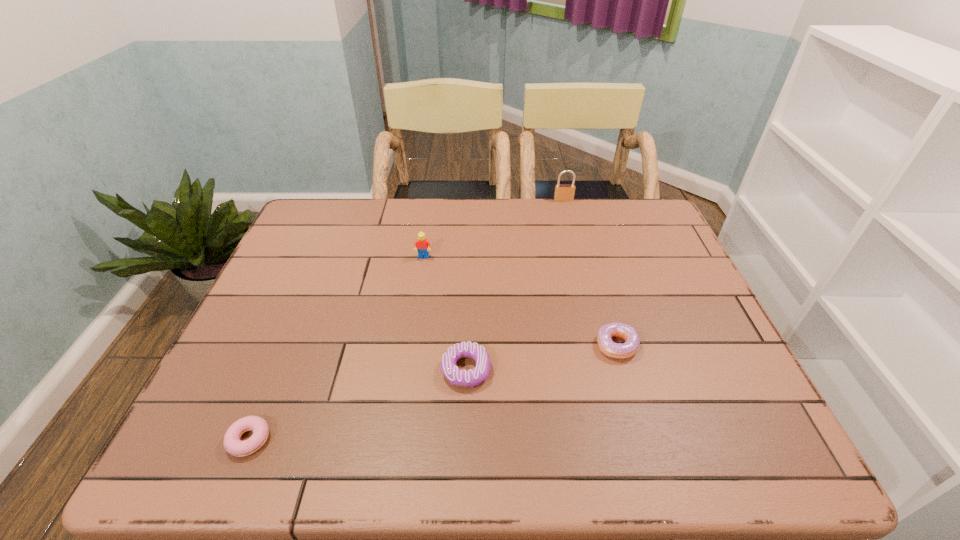
Identify the location of free space between the second doughnut from right to left and the Lego. Image resolution: width=960 pixels, height=540 pixels. (444, 314).

Identify the location of free space between the padlock and the rightmost doughnut. The width and height of the screenshot is (960, 540). (590, 273).

Point out which object is positioned as the fourth nearest to the farthest object. Please provide its 2D coordinates. Your answer should be formatted as a tuple, i.e. [(x, y)], where the tuple contains the x and y coordinates of a point satisfying the conditions above.

[(233, 445)]

Locate which object ranks second in proximity to the second doughnut from right to left. Please provide its 2D coordinates. Your answer should be formatted as a tuple, i.e. [(x, y)], where the tuple contains the x and y coordinates of a point satisfying the conditions above.

[(233, 445)]

Select which doughnut is the second closest to the rightmost doughnut. Please provide its 2D coordinates. Your answer should be formatted as a tuple, i.e. [(x, y)], where the tuple contains the x and y coordinates of a point satisfying the conditions above.

[(233, 445)]

You are a GUI agent. You are given a task and a screenshot of the screen. Output one action in this format:
    pyautogui.click(x=<x>, y=<y>)
    Task: Click on the doughnut that is the second closest to the nearest object
    The height and width of the screenshot is (540, 960).
    Given the screenshot: What is the action you would take?
    pyautogui.click(x=625, y=350)

Locate an element on the screen. The height and width of the screenshot is (540, 960). free region that satisfies the following two spatial constraints: 1. on the face of the fourth object from right to left; 2. on the left side of the second doughnut from left to right is located at coordinates (407, 370).

In order to click on free space that satisfies the following two spatial constraints: 1. on the back side of the second doughnut from right to left; 2. on the left side of the rightmost doughnut in this screenshot , I will do `click(467, 345)`.

Identify the location of free spot that satisfies the following two spatial constraints: 1. on the front-facing side of the rightmost doughnut; 2. on the left side of the farthest object. (601, 345).

Find the location of `free space that satisfies the following two spatial constraints: 1. on the back side of the second doughnut from left to right; 2. on the left side of the shortest doughnut`. free space that satisfies the following two spatial constraints: 1. on the back side of the second doughnut from left to right; 2. on the left side of the shortest doughnut is located at coordinates (277, 370).